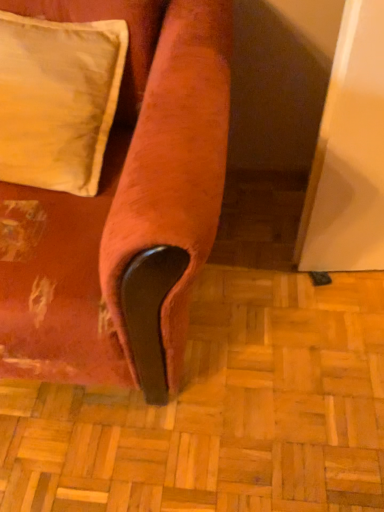
Question: Is point (104, 183) positioned closer to the camera than point (77, 61)?

Choices:
 (A) closer
 (B) farther

Answer: (B)

Question: Looking at the image, does velvet-like orange couch at lower left seem bigger or smaller compared to satin cream pillow at upper left?

Choices:
 (A) big
 (B) small

Answer: (A)

Question: Considering the positions of velvet-like orange couch at lower left and satin cream pillow at upper left in the image, is velvet-like orange couch at lower left taller or shorter than satin cream pillow at upper left?

Choices:
 (A) tall
 (B) short

Answer: (A)

Question: Choose the correct answer: Is satin cream pillow at upper left inside velvet-like orange couch at lower left or outside it?

Choices:
 (A) outside
 (B) inside

Answer: (B)

Question: From the image's perspective, is satin cream pillow at upper left above or below velvet-like orange couch at lower left?

Choices:
 (A) above
 (B) below

Answer: (A)

Question: From a real-world perspective, relative to velvet-like orange couch at lower left, is satin cream pillow at upper left vertically above or below?

Choices:
 (A) below
 (B) above

Answer: (B)

Question: Looking at their shapes, would you say satin cream pillow at upper left is wider or thinner than velvet-like orange couch at lower left?

Choices:
 (A) thin
 (B) wide

Answer: (A)